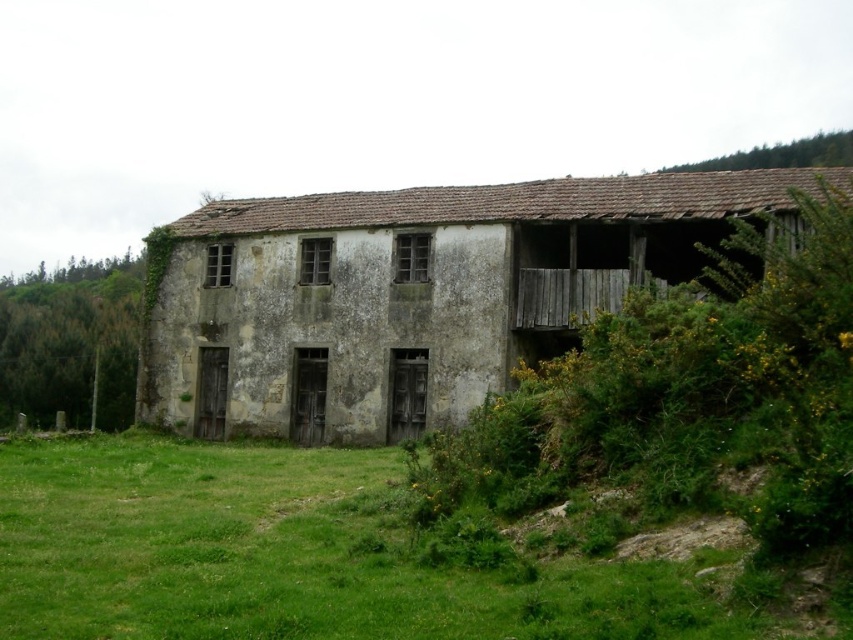
You are standing in the rural area and see the weathered concrete hut at center and the green grass at lower left. Which object is higher in height?

The weathered concrete hut at center is taller than the green grass at lower left.

You are standing on the green grass at lower left and want to reach the weathered concrete hut at center. Which direction should you move to get there?

You should move upward to reach the weathered concrete hut at center since it is located above the green grass at lower left.

You are standing at the origin point in the image. Where is the weathered concrete hut at center located in terms of coordinates?

The weathered concrete hut at center is located at coordinates point (410,292).